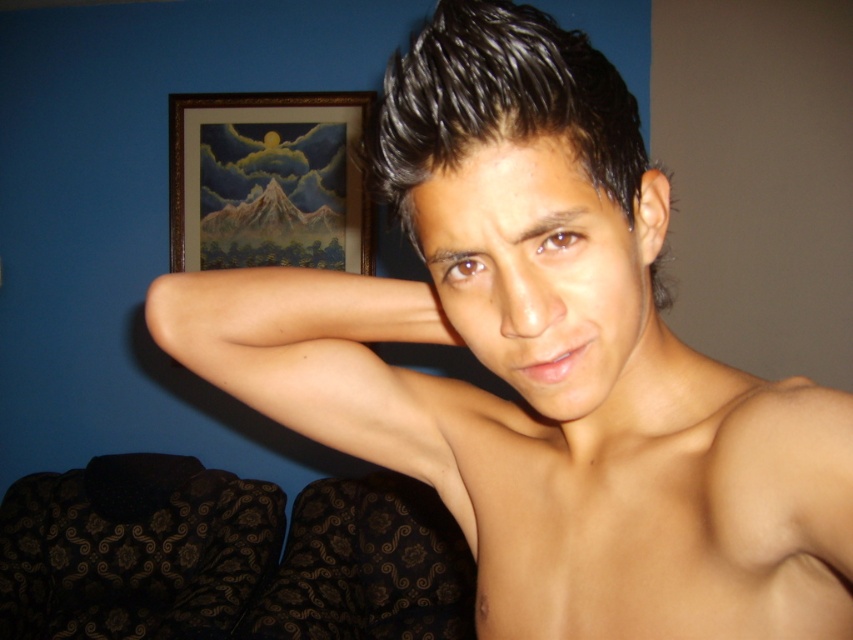
Question: Can you confirm if skinny white skin at center is positioned to the right of skinny flesh at center?

Choices:
 (A) yes
 (B) no

Answer: (A)

Question: Can you confirm if skinny white skin at center is thinner than black shiny hair at center?

Choices:
 (A) yes
 (B) no

Answer: (A)

Question: Among these objects, which one is nearest to the camera?

Choices:
 (A) skinny white skin at center
 (B) black shiny hair at center
 (C) skinny flesh at center
 (D) wooden frame at upper center

Answer: (B)

Question: Which object appears farthest from the camera in this image?

Choices:
 (A) black shiny hair at center
 (B) wooden frame at upper center

Answer: (B)

Question: Can you confirm if skinny white skin at center is positioned to the left of wooden frame at upper center?

Choices:
 (A) no
 (B) yes

Answer: (A)

Question: Based on their relative distances, which object is nearer to the skinny flesh at center?

Choices:
 (A) wooden frame at upper center
 (B) black shiny hair at center

Answer: (B)